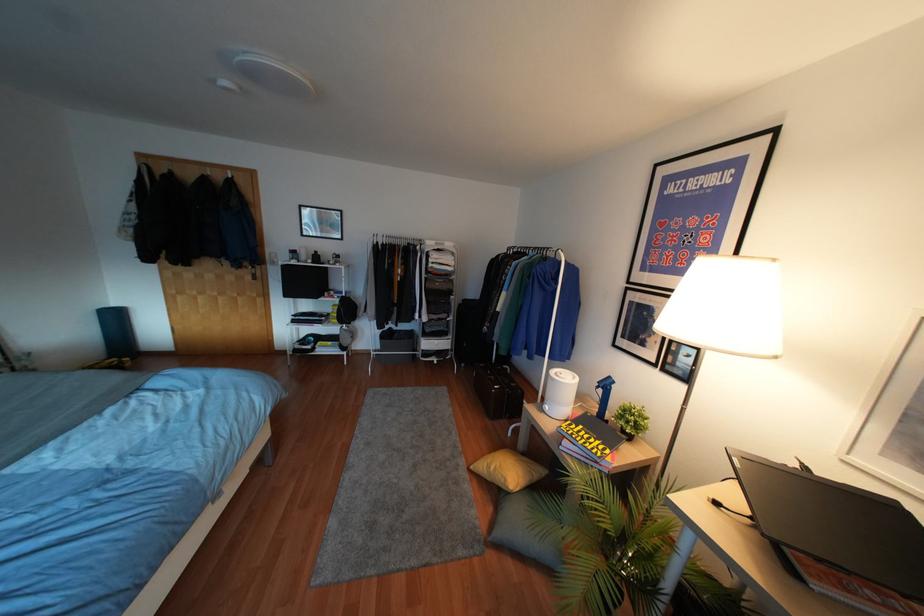
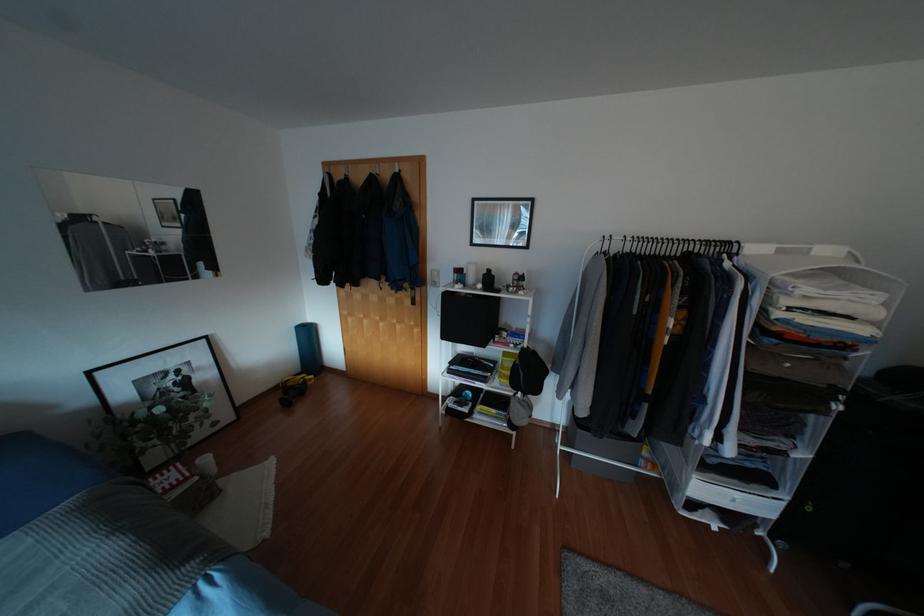
Find the pixel in the second image that matches point (312, 262) in the first image.

(483, 289)